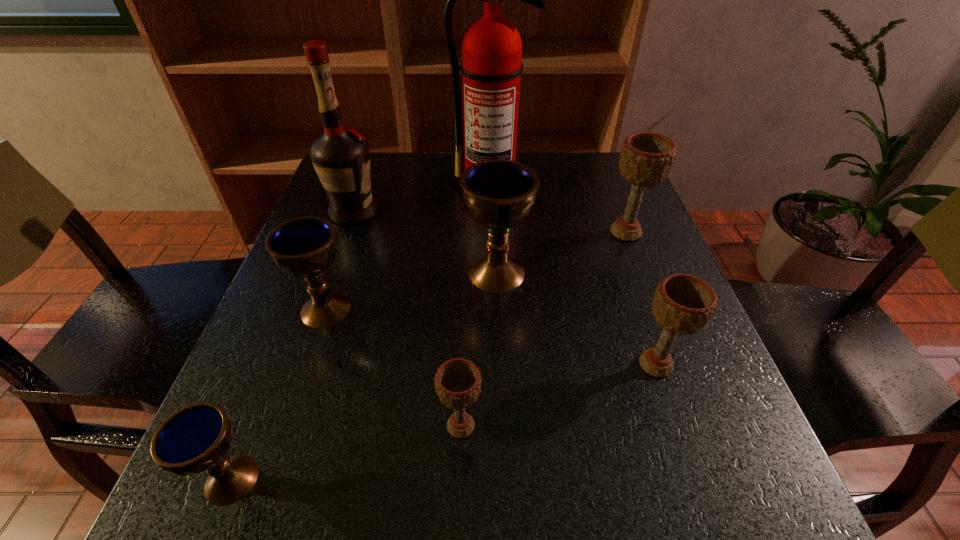
Find the location of a particular element. Image resolution: width=960 pixels, height=540 pixels. fire extinguisher is located at coordinates (491, 66).

Find the location of a particular element. liquor is located at coordinates (341, 158).

The image size is (960, 540). I want to click on the farthest beige chalice, so click(646, 159).

I want to click on the biggest beige chalice, so click(x=646, y=159).

This screenshot has height=540, width=960. In order to click on the rightmost blue chalice in this screenshot , I will do `click(498, 194)`.

This screenshot has width=960, height=540. Identify the location of the second biggest blue chalice. pyautogui.click(x=305, y=247).

Locate an element on the screen. The image size is (960, 540). the third nearest object is located at coordinates (683, 304).

Identify the location of the second farthest beige chalice. This screenshot has height=540, width=960. (683, 304).

This screenshot has height=540, width=960. In order to click on the leftmost beige chalice in this screenshot , I will do `click(458, 381)`.

Where is `the second nearest chalice`? The height and width of the screenshot is (540, 960). the second nearest chalice is located at coordinates (458, 381).